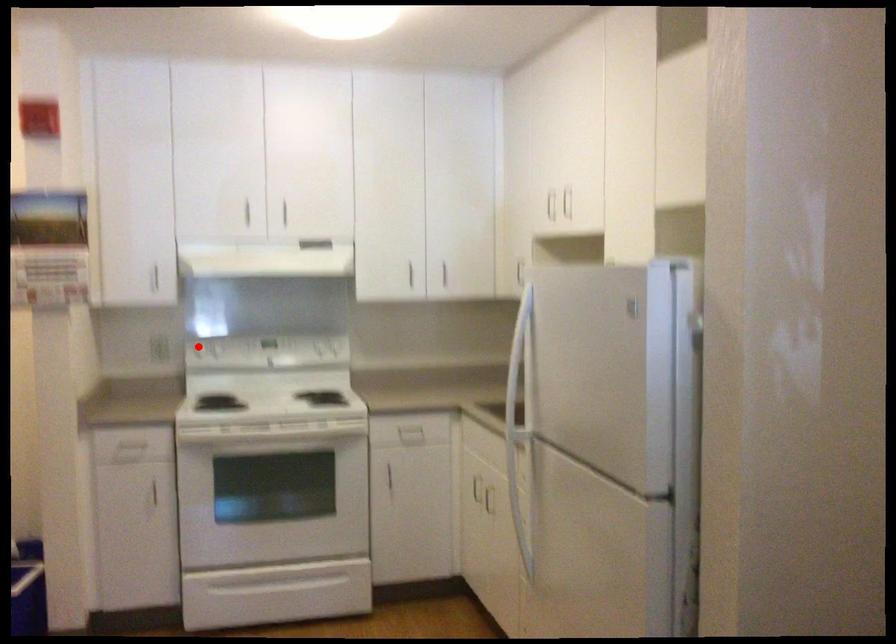
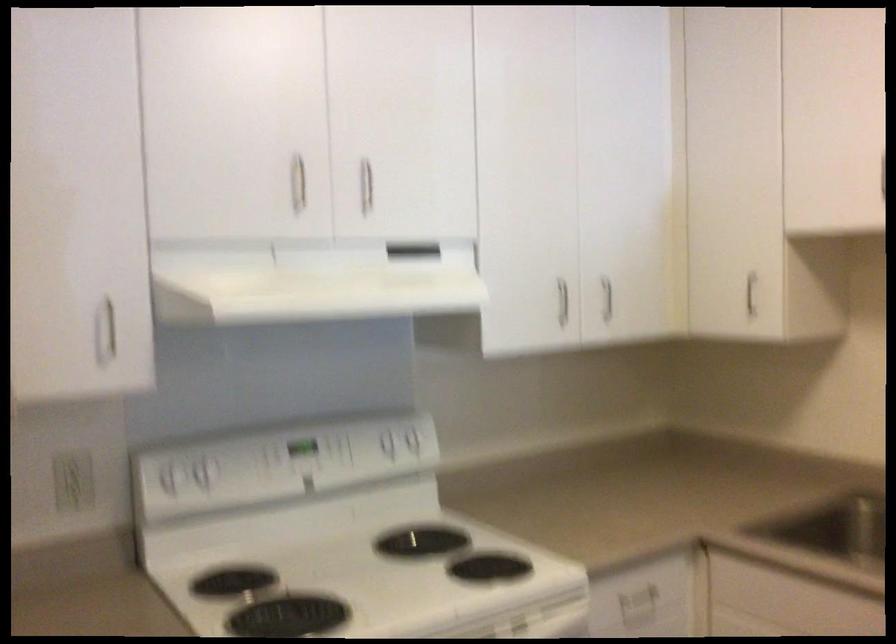
Question: I am providing you with two images of the same scene from different viewpoints. Given a red point in image1, look at the same physical point in image2. Is it:

Choices:
 (A) Closer to the viewpoint
 (B) Farther from the viewpoint

Answer: (A)